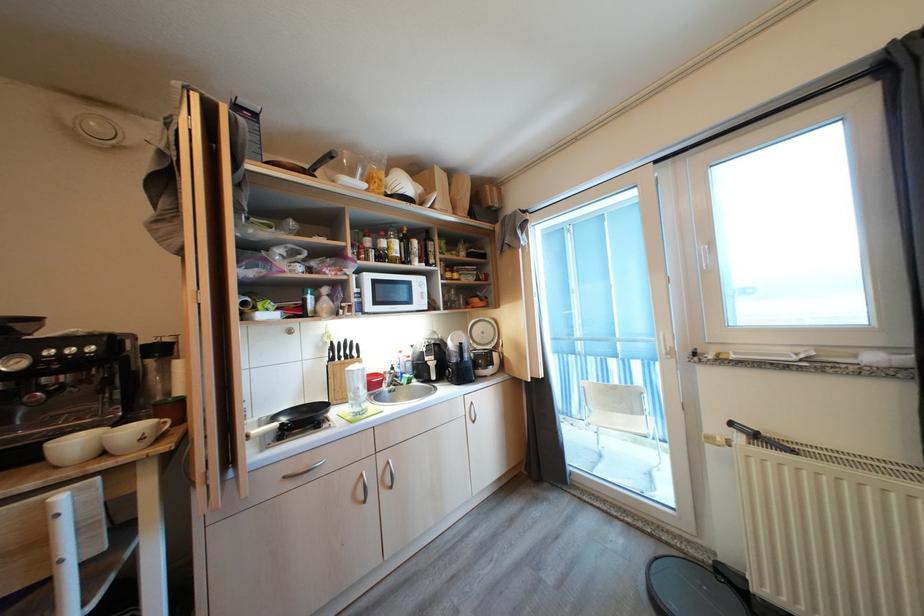
Where would you turn the white window handle? Please return your answer as a coordinate pair (x, y).

(703, 256)